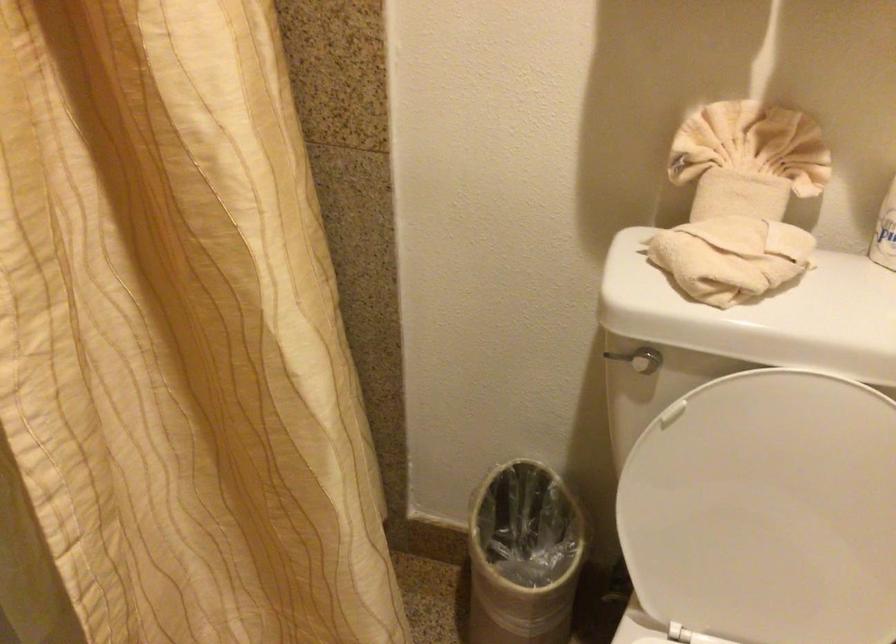
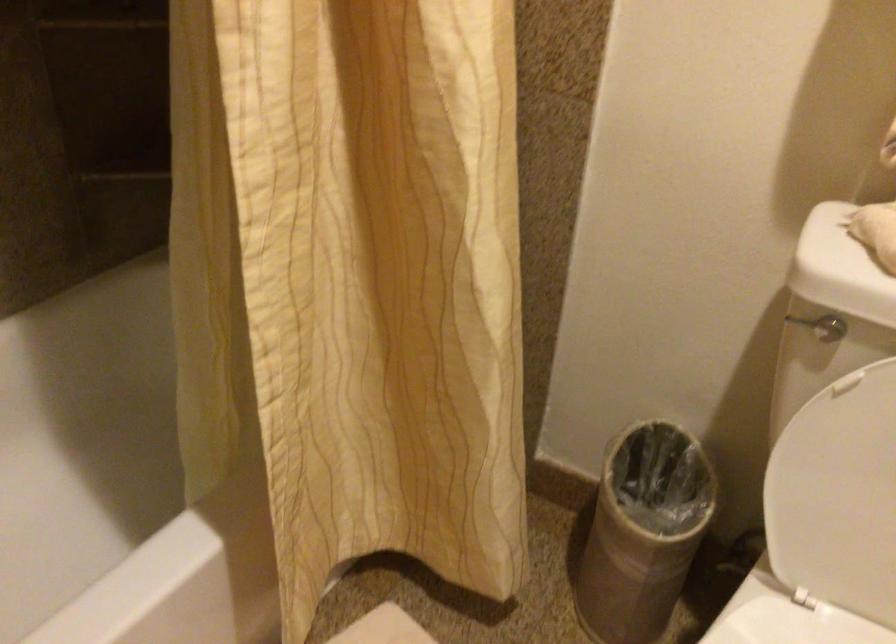
In a continuous first-person perspective shot, in which direction is the camera moving?

The movement direction of the cameraman is left, backward.